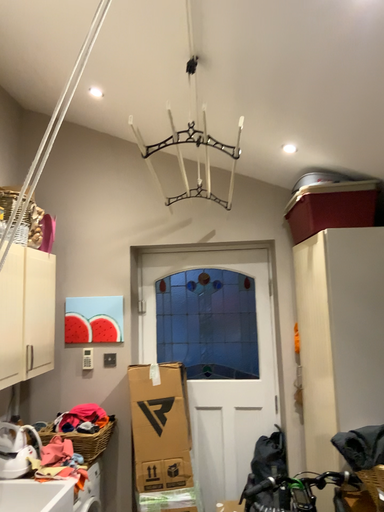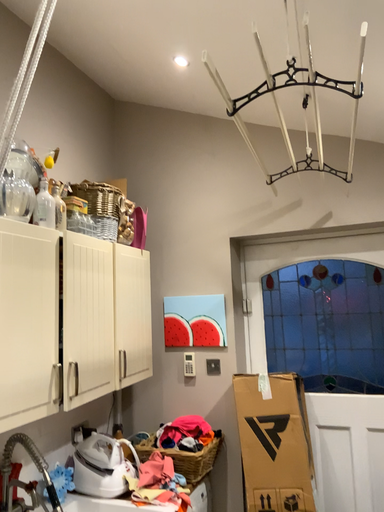
Question: Which way did the camera rotate in the video?

Choices:
 (A) rotated right
 (B) rotated left

Answer: (B)